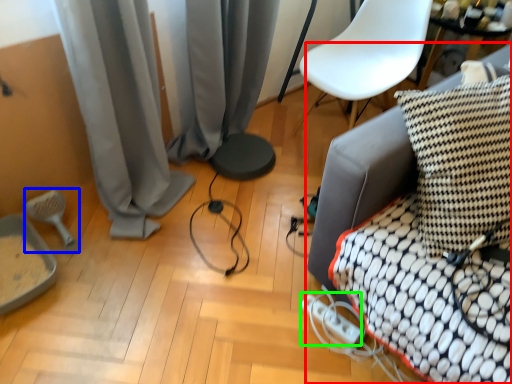
Question: Based on their relative distances, which object is nearer to furniture (highlighted by a red box)? Choose from brush (highlighted by a blue box) and extension cord (highlighted by a green box).

Choices:
 (A) brush
 (B) extension cord

Answer: (B)